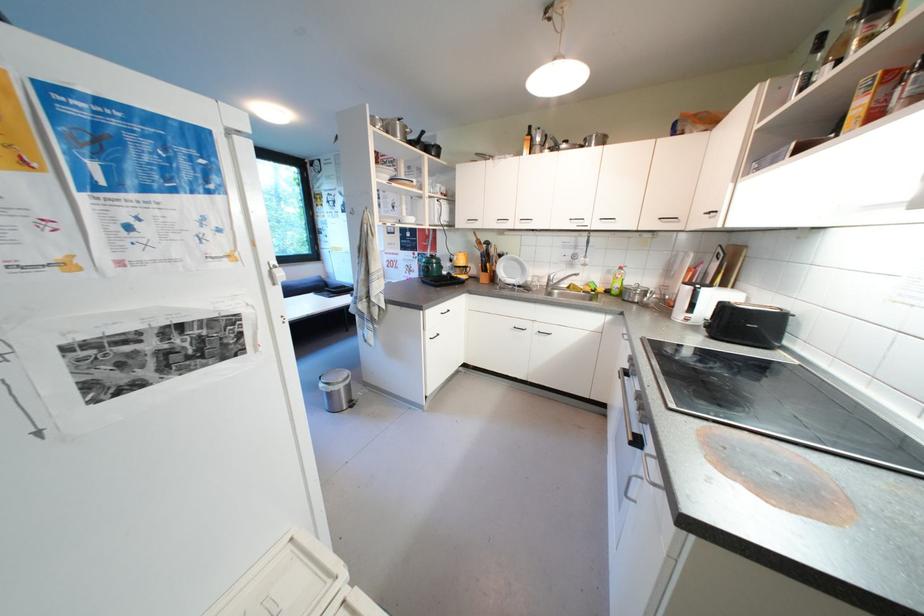
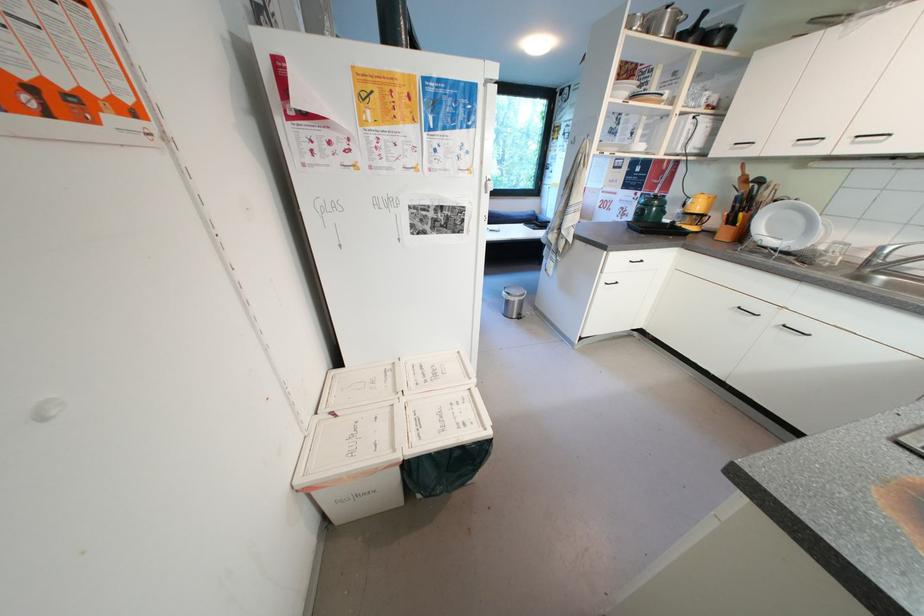
Locate, in the second image, the point that corresponds to (424,254) in the first image.

(647, 196)